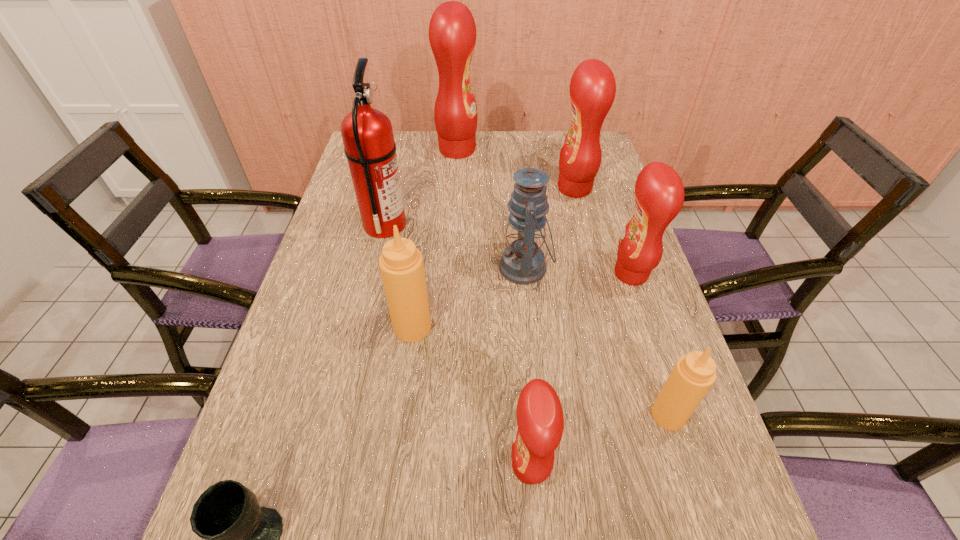
Where is `vacant area that lies between the biggest red condiment and the nearest red condiment`? The height and width of the screenshot is (540, 960). vacant area that lies between the biggest red condiment and the nearest red condiment is located at coordinates (493, 308).

Identify the location of object that is the third closest to the farthest object. The image size is (960, 540). (523, 262).

Find the location of a particular element. The height and width of the screenshot is (540, 960). object that stands as the third closest to the farthest condiment is located at coordinates (523, 262).

The image size is (960, 540). I want to click on condiment that stands as the closest to the third farthest condiment, so click(592, 87).

You are a GUI agent. You are given a task and a screenshot of the screen. Output one action in this format:
    pyautogui.click(x=<x>, y=<y>)
    Task: Click on the second closest condiment to the fourth farthest condiment
    
    Given the screenshot: What is the action you would take?
    pyautogui.click(x=659, y=192)

Point out which red condiment is positioned as the third nearest to the second nearest red condiment. Please provide its 2D coordinates. Your answer should be formatted as a tuple, i.e. [(x, y)], where the tuple contains the x and y coordinates of a point satisfying the conditions above.

[(452, 31)]

Where is `red condiment that stands as the second closest to the lantern`? The image size is (960, 540). red condiment that stands as the second closest to the lantern is located at coordinates (592, 87).

The image size is (960, 540). Find the location of `vacant area in the image that satisfies the following two spatial constraints: 1. at the nozzle of the third nearest condiment; 2. on the left side of the fire extinguisher`. vacant area in the image that satisfies the following two spatial constraints: 1. at the nozzle of the third nearest condiment; 2. on the left side of the fire extinguisher is located at coordinates (361, 327).